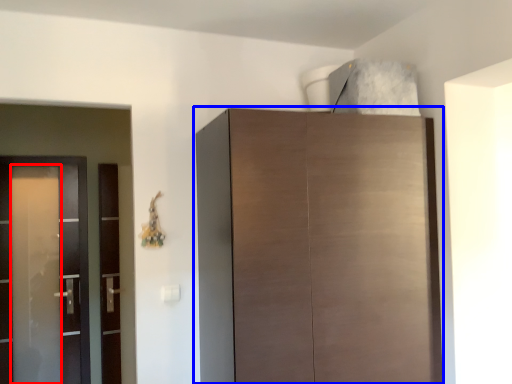
Question: Among these objects, which one is nearest to the camera, screen door (highlighted by a red box) or cupboard (highlighted by a blue box)?

Choices:
 (A) screen door
 (B) cupboard

Answer: (B)